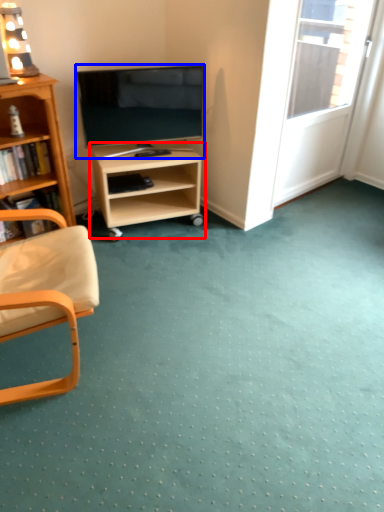
Question: Which object appears farthest to the camera in this image, shelf (highlighted by a red box) or television (highlighted by a blue box)?

Choices:
 (A) shelf
 (B) television

Answer: (A)